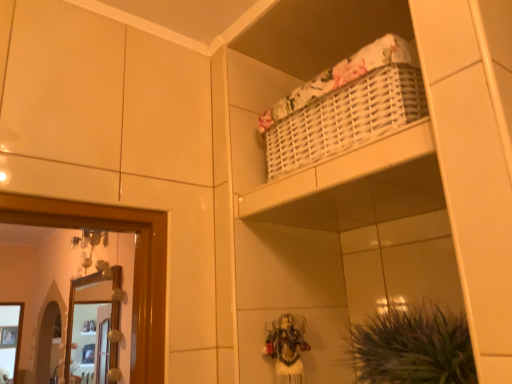
Locate an element on the screen. Image resolution: width=512 pixels, height=384 pixels. wooden framed mirror at left is located at coordinates (94, 328).

This screenshot has height=384, width=512. What do you see at coordinates (94, 328) in the screenshot?
I see `wooden framed mirror at left` at bounding box center [94, 328].

What do you see at coordinates (412, 347) in the screenshot? I see `green leafy plant at lower right` at bounding box center [412, 347].

Locate an element on the screen. Image resolution: width=512 pixels, height=384 pixels. green leafy plant at lower right is located at coordinates (412, 347).

Image resolution: width=512 pixels, height=384 pixels. I want to click on wooden framed mirror at left, so click(x=94, y=328).

Would you say wooden framed mirror at left is to the left or to the right of green leafy plant at lower right in the picture?

wooden framed mirror at left is positioned on green leafy plant at lower right's left side.

Is the depth of wooden framed mirror at left less than that of green leafy plant at lower right?

No, it is not.

Which point is more forward, (97,365) or (355,369)?

Point (355,369)

From the image's perspective, which is above, wooden framed mirror at left or green leafy plant at lower right?

green leafy plant at lower right, from the image's perspective.

From a real-world perspective, is wooden framed mirror at left over green leafy plant at lower right?

Yes, from a real-world perspective, wooden framed mirror at left is above green leafy plant at lower right.

In terms of width, does wooden framed mirror at left look wider or thinner when compared to green leafy plant at lower right?

wooden framed mirror at left is thinner than green leafy plant at lower right.

Does wooden framed mirror at left have a greater height compared to green leafy plant at lower right?

Yes.

Considering the relative sizes of wooden framed mirror at left and green leafy plant at lower right in the image provided, is wooden framed mirror at left bigger than green leafy plant at lower right?

Yes.

Is wooden framed mirror at left situated inside green leafy plant at lower right or outside?

wooden framed mirror at left is not inside green leafy plant at lower right, it's outside.

Based on the photo, would you consider wooden framed mirror at left to be distant from green leafy plant at lower right?

Yes, wooden framed mirror at left and green leafy plant at lower right are located far from each other.

Is green leafy plant at lower right at the back of wooden framed mirror at left?

No, wooden framed mirror at left is not facing the opposite direction of green leafy plant at lower right.

How many degrees apart are the facing directions of wooden framed mirror at left and green leafy plant at lower right?

They differ by 8.55 degrees in their facing directions.

You are a GUI agent. You are given a task and a screenshot of the screen. Output one action in this format:
    pyautogui.click(x=<x>, y=<y>)
    Task: Click on the plant that appears above the wooden framed mirror at left (from the image's perspective)
    Image resolution: width=512 pixels, height=384 pixels.
    Given the screenshot: What is the action you would take?
    pyautogui.click(x=412, y=347)

Looking at this image, which is more to the right, green leafy plant at lower right or wooden framed mirror at left?

green leafy plant at lower right.

In the image, is green leafy plant at lower right positioned in front of or behind wooden framed mirror at left?

Clearly, green leafy plant at lower right is in front of wooden framed mirror at left.

Does point (384, 327) lie in front of point (87, 293)?

Yes, point (384, 327) is in front of point (87, 293).

From the image's perspective, which one is positioned lower, green leafy plant at lower right or wooden framed mirror at left?

wooden framed mirror at left appears lower in the image.

From a real-world perspective, which object rests below the other?

In real-world perspective, green leafy plant at lower right is lower.

Considering the relative sizes of green leafy plant at lower right and wooden framed mirror at left in the image provided, is green leafy plant at lower right wider than wooden framed mirror at left?

Yes, green leafy plant at lower right is wider than wooden framed mirror at left.

From their relative heights in the image, would you say green leafy plant at lower right is taller or shorter than wooden framed mirror at left?

green leafy plant at lower right is shorter than wooden framed mirror at left.

Does green leafy plant at lower right have a larger size compared to wooden framed mirror at left?

No, green leafy plant at lower right is not bigger than wooden framed mirror at left.

Does green leafy plant at lower right contain wooden framed mirror at left?

Definitely not — wooden framed mirror at left is not inside green leafy plant at lower right.

Is green leafy plant at lower right placed right next to wooden framed mirror at left?

No, green leafy plant at lower right is not beside wooden framed mirror at left.

Could you tell me if green leafy plant at lower right is turned towards wooden framed mirror at left?

No.

How many degrees apart are the facing directions of green leafy plant at lower right and wooden framed mirror at left?

The facing directions of green leafy plant at lower right and wooden framed mirror at left are 8.55 degrees apart.

Locate an element on the screen. The image size is (512, 384). plant above the wooden framed mirror at left (from the image's perspective) is located at coordinates (412, 347).

Image resolution: width=512 pixels, height=384 pixels. I want to click on plant lying in front of the wooden framed mirror at left, so click(412, 347).

The height and width of the screenshot is (384, 512). Identify the location of plant above the wooden framed mirror at left (from the image's perspective). (412, 347).